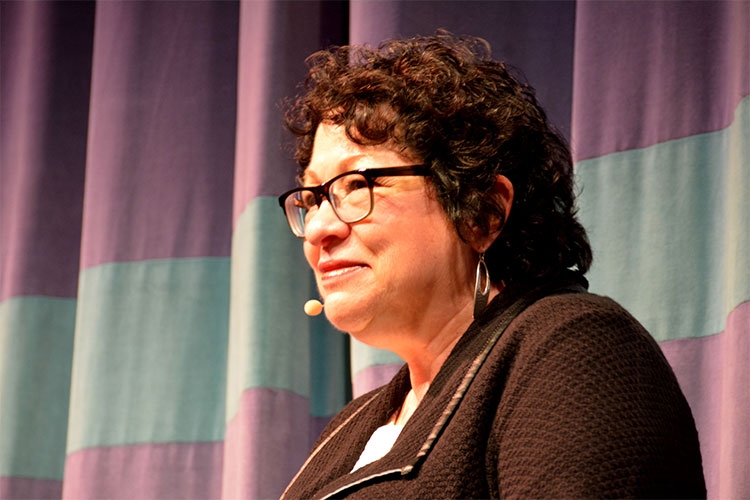
Find the location of a particular element. purple curtain is located at coordinates (214, 223).